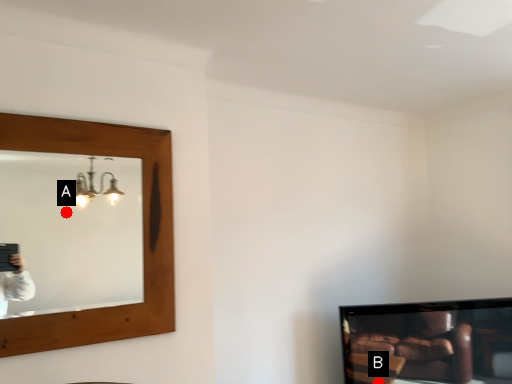
Question: Two points are circled on the image, labeled by A and B beside each circle. Which point is closer to the camera taking this photo?

Choices:
 (A) A is closer
 (B) B is closer

Answer: (B)